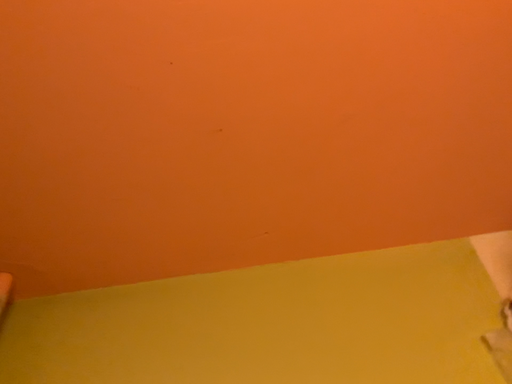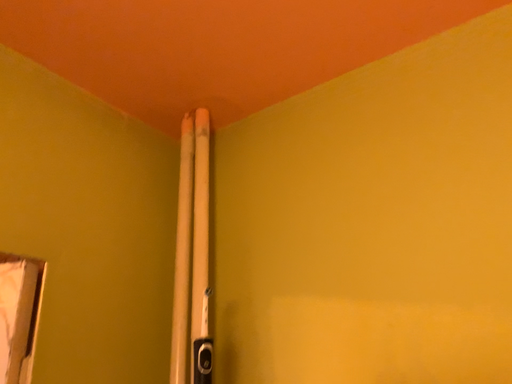
Question: Which way did the camera rotate in the video?

Choices:
 (A) rotated right
 (B) rotated left

Answer: (B)